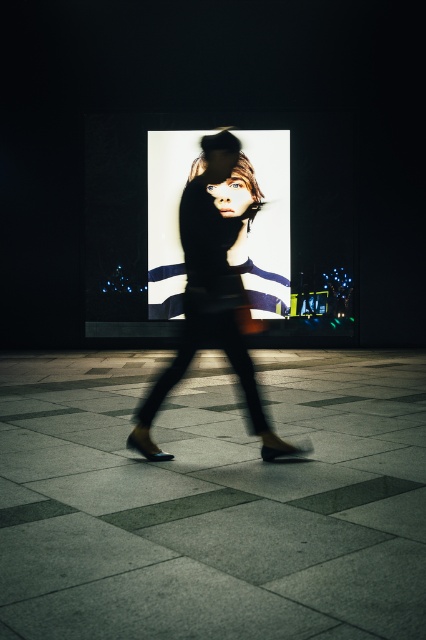
Question: Can you confirm if silky black dress at center is thinner than matte black portrait at center?

Choices:
 (A) no
 (B) yes

Answer: (B)

Question: Does dark gray concrete pavement at center appear on the left side of silky black dress at center?

Choices:
 (A) yes
 (B) no

Answer: (A)

Question: Which of the following is the farthest from the observer?

Choices:
 (A) (100, 624)
 (B) (221, 198)
 (C) (152, 301)

Answer: (C)

Question: Which of the following is the farthest from the observer?

Choices:
 (A) matte black portrait at center
 (B) dark gray concrete pavement at center

Answer: (A)

Question: Is silky black dress at center above matte black portrait at center?

Choices:
 (A) yes
 (B) no

Answer: (B)

Question: Which is farther from the matte black portrait at center?

Choices:
 (A) silky black dress at center
 (B) dark gray concrete pavement at center

Answer: (B)